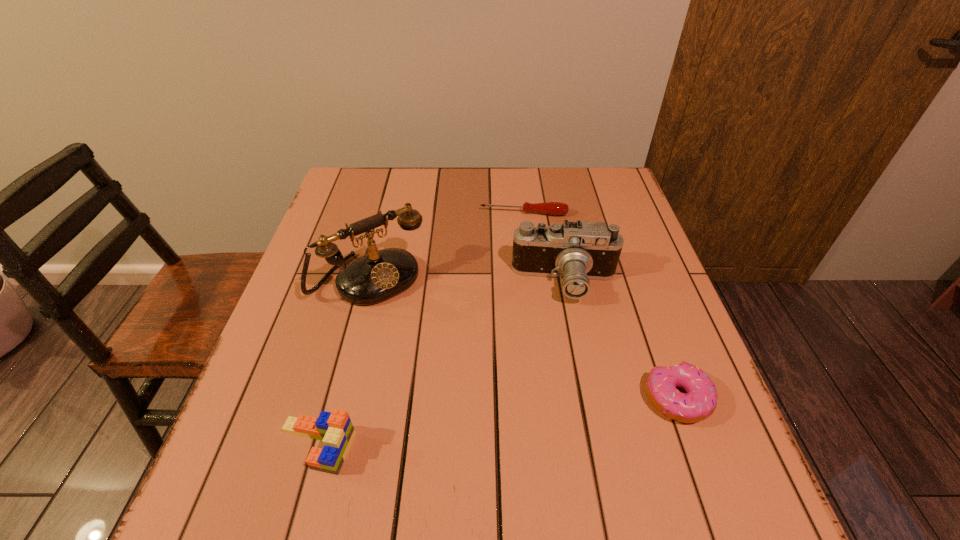
Locate which object is the closest to the screwdriver. Please provide its 2D coordinates. Your answer should be formatted as a tuple, i.e. [(x, y)], where the tuple contains the x and y coordinates of a point satisfying the conditions above.

[(578, 251)]

The height and width of the screenshot is (540, 960). I want to click on object that stands as the second closest to the camera, so click(x=550, y=208).

The height and width of the screenshot is (540, 960). I want to click on free space that satisfies the following two spatial constraints: 1. on the back side of the screwdriver; 2. on the left side of the tallest object, so point(387,214).

Locate an element on the screen. free spot that satisfies the following two spatial constraints: 1. on the back side of the third tallest object; 2. on the left side of the doughnut is located at coordinates (329, 399).

Locate an element on the screen. free point that satisfies the following two spatial constraints: 1. on the front side of the telephone; 2. on the right side of the fourth tallest object is located at coordinates (340, 399).